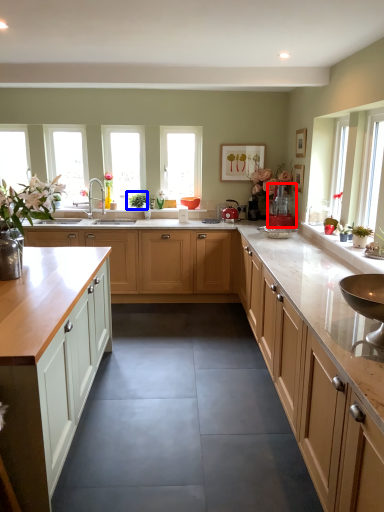
Question: Which object appears farthest to the camera in this image, appliance (highlighted by a red box) or plant (highlighted by a blue box)?

Choices:
 (A) appliance
 (B) plant

Answer: (B)